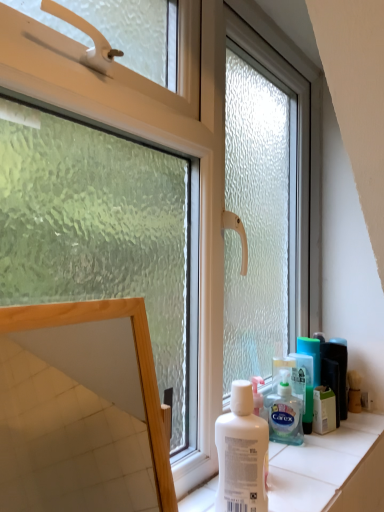
Question: Can green plastic mouthwash at right be found inside white plastic box at right?

Choices:
 (A) yes
 (B) no

Answer: (B)

Question: Does white plastic box at right appear on the right side of green plastic mouthwash at right?

Choices:
 (A) no
 (B) yes

Answer: (B)

Question: From a real-world perspective, is white plastic box at right physically above green plastic mouthwash at right?

Choices:
 (A) no
 (B) yes

Answer: (A)

Question: From the image's perspective, is white plastic box at right located above green plastic mouthwash at right?

Choices:
 (A) no
 (B) yes

Answer: (A)

Question: Can you confirm if white plastic box at right is bigger than green plastic mouthwash at right?

Choices:
 (A) no
 (B) yes

Answer: (A)

Question: Considering the relative sizes of white plastic box at right and green plastic mouthwash at right in the image provided, is white plastic box at right taller than green plastic mouthwash at right?

Choices:
 (A) yes
 (B) no

Answer: (B)

Question: From a real-world perspective, is translucent plastic shaving cream at lower right under green plastic mouthwash at right?

Choices:
 (A) no
 (B) yes

Answer: (B)

Question: Is translucent plastic shaving cream at lower right with green plastic mouthwash at right?

Choices:
 (A) yes
 (B) no

Answer: (A)

Question: Is translucent plastic shaving cream at lower right looking in the opposite direction of green plastic mouthwash at right?

Choices:
 (A) no
 (B) yes

Answer: (A)

Question: Is translucent plastic shaving cream at lower right at the left side of green plastic mouthwash at right?

Choices:
 (A) no
 (B) yes

Answer: (B)

Question: Is translucent plastic shaving cream at lower right thinner than green plastic mouthwash at right?

Choices:
 (A) no
 (B) yes

Answer: (A)

Question: Considering the relative sizes of translucent plastic shaving cream at lower right and green plastic mouthwash at right in the image provided, is translucent plastic shaving cream at lower right taller than green plastic mouthwash at right?

Choices:
 (A) no
 (B) yes

Answer: (A)

Question: Considering the relative positions of white matte bottle at center and wooden frame mirror at lower left in the image provided, is white matte bottle at center to the right of wooden frame mirror at lower left from the viewer's perspective?

Choices:
 (A) yes
 (B) no

Answer: (A)